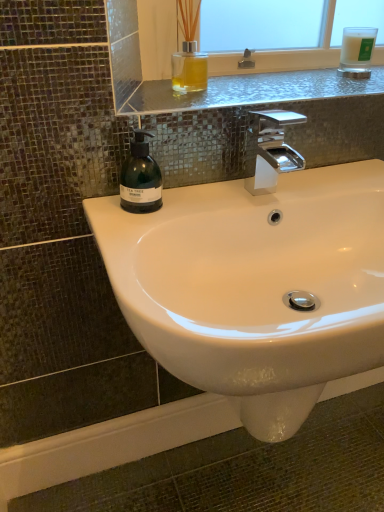
Locate an element on the screen. free spot in front of green matte soap dispenser at left is located at coordinates (134, 232).